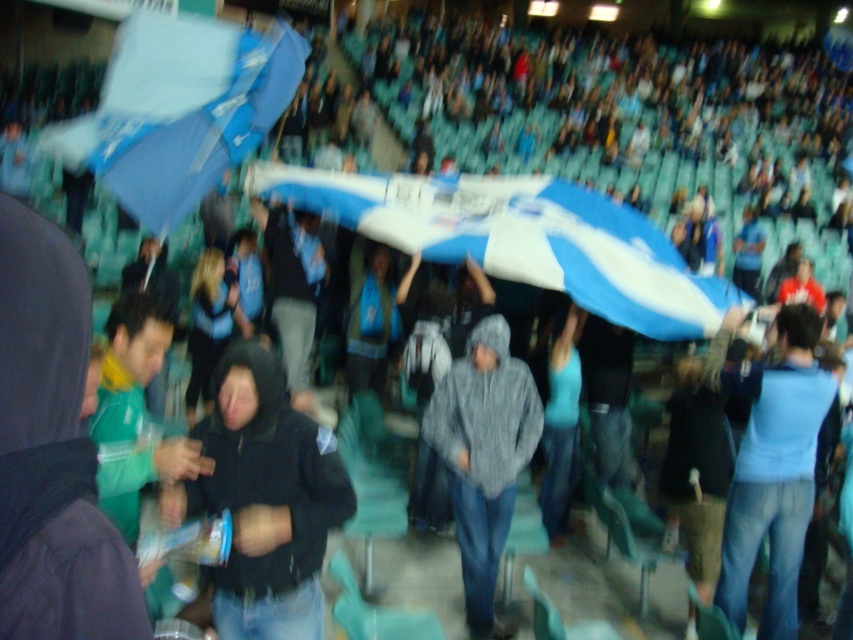
You are standing at the origin point of the coordinate system in the image and want to find the black matte hoodie at center. Which direction should you move to locate it?

The black matte hoodie at center is located at coordinate point 0.781 on the x axis and 0.311 on the y axis. Since the origin is at the bottom left corner of the image, you should move to the right and slightly upward to reach the black matte hoodie at center.

You are a photographer at the stadium and want to take a photo of the black matte hoodie at center and the gray hoodie at center. Which hoodie should you focus on first if you want to capture the one that is closer to the front?

The black matte hoodie at center is shorter than the gray hoodie at center, so it is closer to the front. You should focus on the black matte hoodie at center first.

You are a photographer standing in the crowd at the stadium. You want to take a photo of both the black matte hoodie at center and the gray hoodie at center without any obstruction. Which hoodie should you focus on first to ensure it is in the foreground?

The black matte hoodie at center is above the gray hoodie at center, so focusing on the black matte hoodie at center first will ensure it appears in the foreground without blocking the gray hoodie at center.